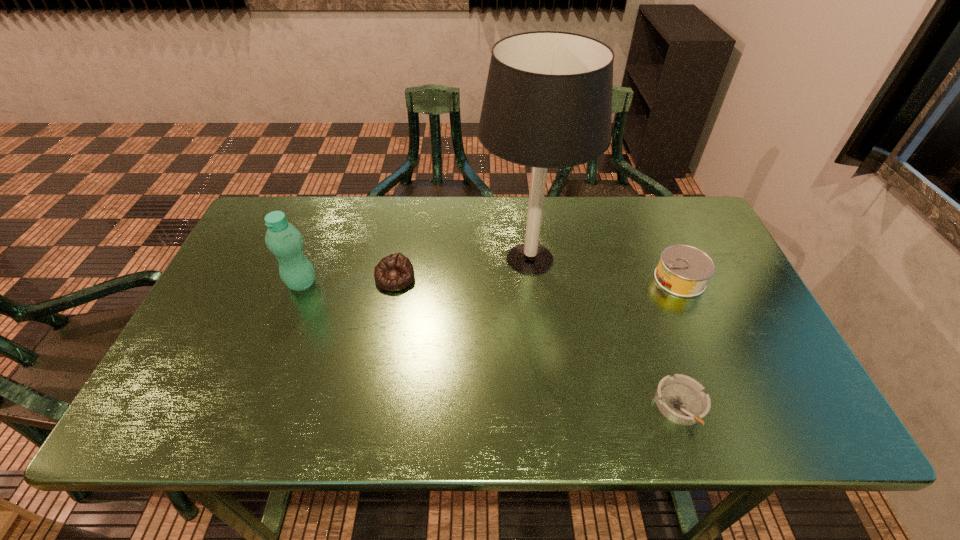
What are the coordinates of `vacant space located on the back of the leftmost object` in the screenshot? It's located at (324, 226).

Where is `vacant space situated 0.290m on the front of the can`? The width and height of the screenshot is (960, 540). vacant space situated 0.290m on the front of the can is located at coordinates (732, 398).

What are the coordinates of `free point located 0.110m on the right of the beanbag` in the screenshot? It's located at (455, 278).

Find the location of a particular element. free location located 0.380m on the back of the nearest object is located at coordinates (632, 263).

What are the coordinates of `object that is at the far edge` in the screenshot? It's located at (548, 100).

Image resolution: width=960 pixels, height=540 pixels. Find the location of `object that is positioned at the near edge`. object that is positioned at the near edge is located at coordinates (x=681, y=399).

What are the coordinates of `object present at the right edge` in the screenshot? It's located at (683, 270).

You are a GUI agent. You are given a task and a screenshot of the screen. Output one action in this format:
    pyautogui.click(x=<x>, y=<y>)
    Task: Click on the free space at the far edge of the desktop
    Image resolution: width=960 pixels, height=540 pixels.
    Given the screenshot: What is the action you would take?
    pyautogui.click(x=351, y=212)

Locate an element on the screen. vacant space at the near edge of the desktop is located at coordinates (608, 397).

You are a GUI agent. You are given a task and a screenshot of the screen. Output one action in this format:
    pyautogui.click(x=<x>, y=<y>)
    Task: Click on the blank space at the left edge
    Image resolution: width=960 pixels, height=540 pixels.
    Given the screenshot: What is the action you would take?
    pyautogui.click(x=253, y=252)